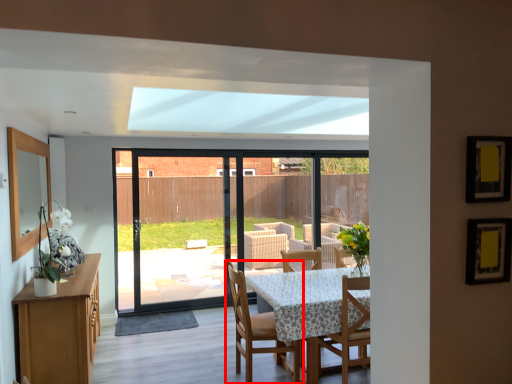
Question: From the image's perspective, considering the relative positions of chair (annotated by the red box) and chair in the image provided, where is chair (annotated by the red box) located with respect to the staircase?

Choices:
 (A) above
 (B) below

Answer: (B)